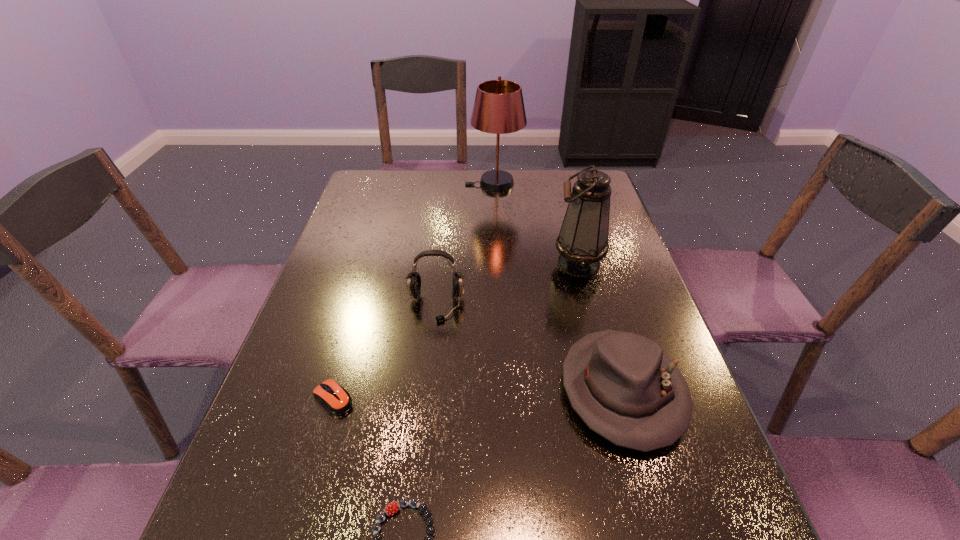
What are the coordinates of `vacant space at the far edge of the desktop` in the screenshot? It's located at (443, 170).

In the image, there is a desktop. Identify the location of blank space at the left edge. The image size is (960, 540). (337, 309).

Where is `free space at the right edge of the desktop`? The height and width of the screenshot is (540, 960). free space at the right edge of the desktop is located at coordinates (676, 491).

In the image, there is a desktop. Identify the location of vacant space at the far left corner. The width and height of the screenshot is (960, 540). (373, 197).

In the image, there is a desktop. Identify the location of vacant area at the far right corner. The image size is (960, 540). (x=576, y=179).

Identify the location of empty space that is in between the second shortest object and the second farthest object. (456, 331).

Where is `vacant point located between the fourth tallest object and the computer mouse`? vacant point located between the fourth tallest object and the computer mouse is located at coordinates pyautogui.click(x=478, y=394).

Identify the location of vacant area that lies between the leftmost object and the third shortest object. (478, 394).

Identify the location of free spot between the fourth nearest object and the hat. This screenshot has height=540, width=960. (529, 348).

The height and width of the screenshot is (540, 960). I want to click on free space between the third shortest object and the headset, so click(529, 348).